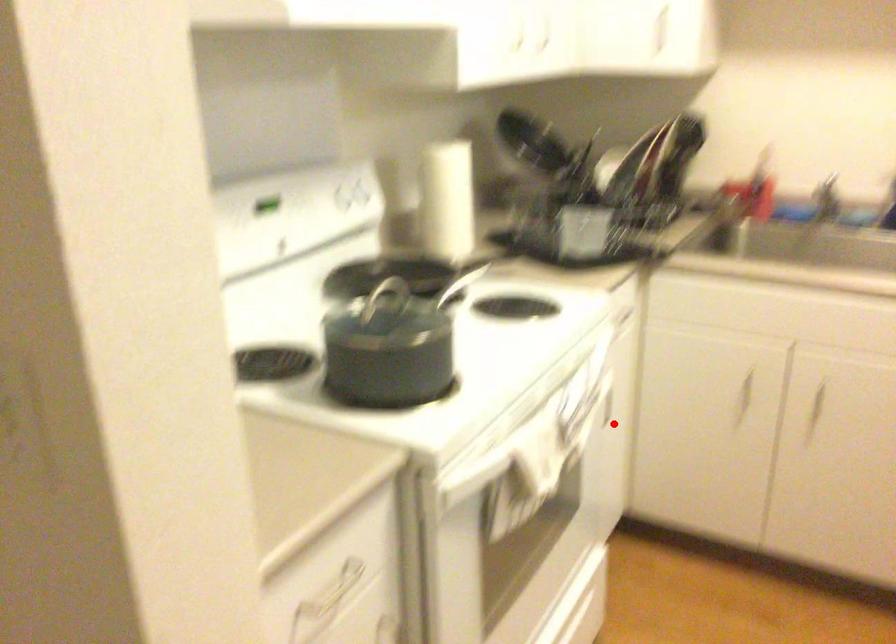
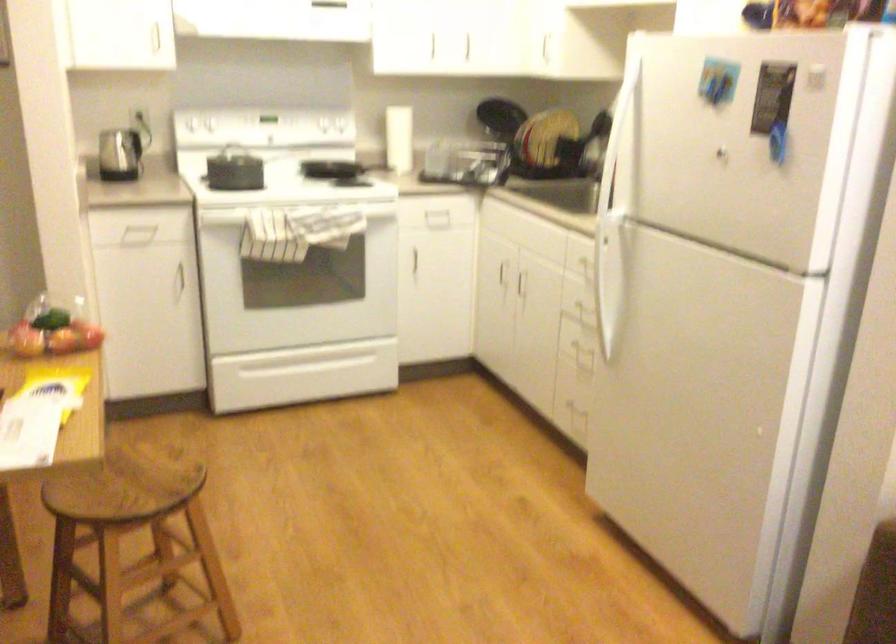
Find the pixel in the second image that matches the highlighted location in the first image.

(435, 276)